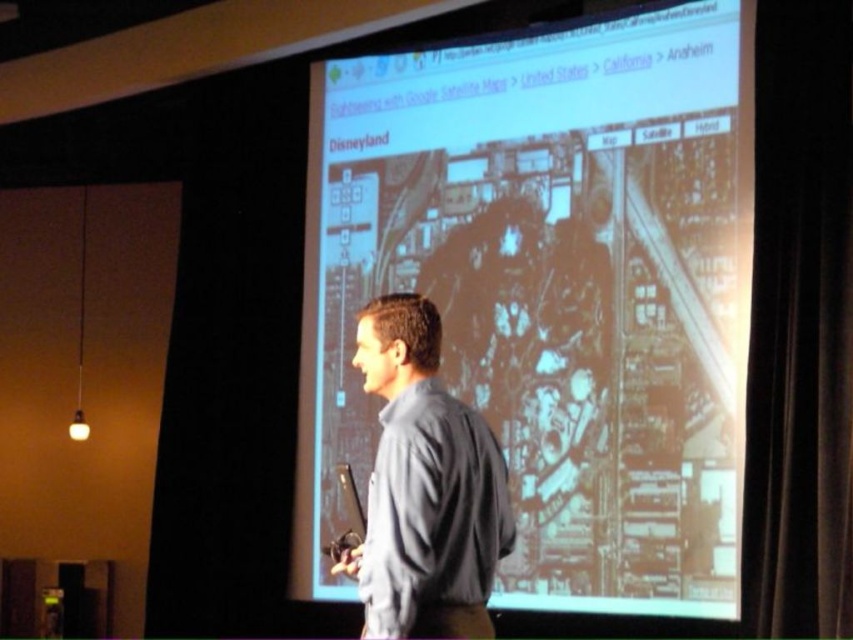
You are attending a presentation and see the point marked at coordinates (550, 291) on the projection screen. Based on the scene description, what does this point represent?

The point at coordinates (550, 291) represents the matte black projector screen at center as indicated in the Objects Description.

From the picture: You are an attendee at a conference and see the matte black projector screen at center and the gray fabric shirt at center. Which object is higher in the image?

The matte black projector screen at center is higher than the gray fabric shirt at center.

You are an attendee at a conference and need to locate the projector screen to follow the presentation. Based on the scene description, where should you look to find the matte black projector screen at center?

The matte black projector screen at center is located at the central position in the scene, as indicated by its label and the coordinates provided.